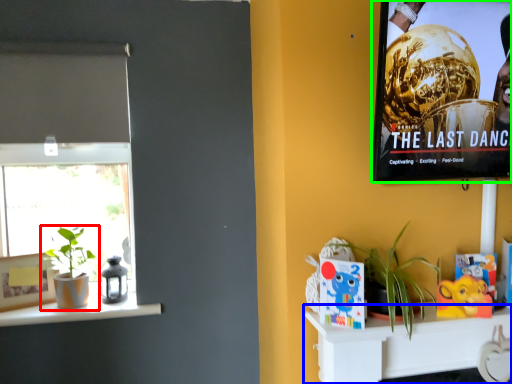
Question: Which object is the closest to the houseplant (highlighted by a red box)? Choose among these: shelf (highlighted by a blue box) or movie poster (highlighted by a green box).

Choices:
 (A) shelf
 (B) movie poster

Answer: (A)